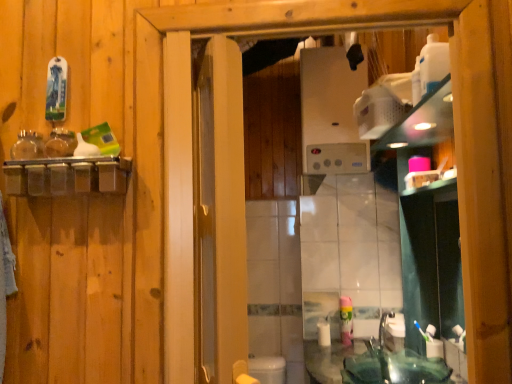
Question: Does white plastic toothbrush at lower right lie in front of green glass sink at lower right?

Choices:
 (A) no
 (B) yes

Answer: (A)

Question: Does white plastic toothbrush at lower right turn towards green glass sink at lower right?

Choices:
 (A) yes
 (B) no

Answer: (B)

Question: Is white plastic toothbrush at lower right looking in the opposite direction of green glass sink at lower right?

Choices:
 (A) yes
 (B) no

Answer: (B)

Question: From a real-world perspective, is white plastic toothbrush at lower right physically below green glass sink at lower right?

Choices:
 (A) yes
 (B) no

Answer: (B)

Question: Is green glass sink at lower right inside white plastic toothbrush at lower right?

Choices:
 (A) yes
 (B) no

Answer: (B)

Question: Is green glass sink at lower right to the left or to the right of green plastic mouthwash at lower right in the image?

Choices:
 (A) left
 (B) right

Answer: (B)

Question: Considering the positions of green glass sink at lower right and green plastic mouthwash at lower right in the image, is green glass sink at lower right wider or thinner than green plastic mouthwash at lower right?

Choices:
 (A) thin
 (B) wide

Answer: (B)

Question: Looking at the image, does green glass sink at lower right seem bigger or smaller compared to green plastic mouthwash at lower right?

Choices:
 (A) big
 (B) small

Answer: (A)

Question: Considering the positions of point (433, 365) and point (351, 307), is point (433, 365) closer or farther from the camera than point (351, 307)?

Choices:
 (A) closer
 (B) farther

Answer: (A)

Question: Considering the positions of point (339, 302) and point (306, 61), is point (339, 302) closer or farther from the camera than point (306, 61)?

Choices:
 (A) closer
 (B) farther

Answer: (A)

Question: In the image, is green plastic mouthwash at lower right positioned in front of or behind satin silver boiler at upper center?

Choices:
 (A) front
 (B) behind

Answer: (A)

Question: Choose the correct answer: Is green plastic mouthwash at lower right inside satin silver boiler at upper center or outside it?

Choices:
 (A) outside
 (B) inside

Answer: (A)

Question: From their relative heights in the image, would you say green plastic mouthwash at lower right is taller or shorter than satin silver boiler at upper center?

Choices:
 (A) tall
 (B) short

Answer: (B)

Question: From the image's perspective, is green glass sink at lower right located above or below white matte toilet paper at lower center?

Choices:
 (A) below
 (B) above

Answer: (A)

Question: Is point (437, 377) positioned closer to the camera than point (330, 344)?

Choices:
 (A) closer
 (B) farther

Answer: (A)